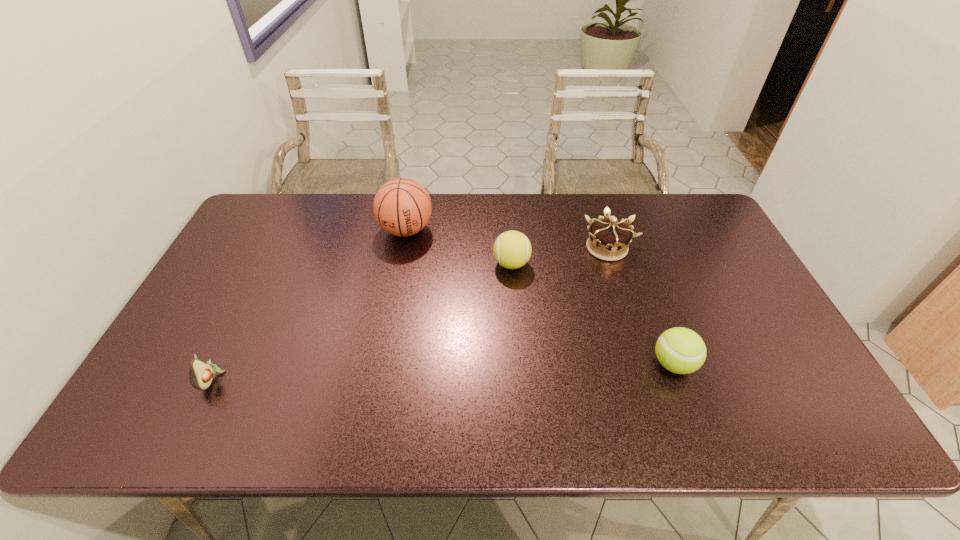
Image resolution: width=960 pixels, height=540 pixels. Identify the location of vacant space located 0.260m on the left of the right tennis ball. (544, 364).

The image size is (960, 540). Identify the location of free space located 0.340m on the seed side of the avocado. tap(365, 379).

I want to click on basketball at the far edge, so click(402, 207).

Where is `crown present at the far edge`? This screenshot has width=960, height=540. crown present at the far edge is located at coordinates (612, 237).

This screenshot has width=960, height=540. What are the coordinates of `object located in the left edge section of the desktop` in the screenshot? It's located at (201, 374).

Find the location of a particular element. Image resolution: width=960 pixels, height=540 pixels. vacant space at the far edge of the desktop is located at coordinates point(491,221).

Image resolution: width=960 pixels, height=540 pixels. I want to click on vacant space at the near edge of the desktop, so click(x=396, y=416).

You are a GUI agent. You are given a task and a screenshot of the screen. Output one action in this format:
    pyautogui.click(x=<x>, y=<y>)
    Task: Click on the vacant area at the left edge
    Image resolution: width=960 pixels, height=540 pixels.
    Given the screenshot: What is the action you would take?
    pyautogui.click(x=207, y=314)

In the image, there is a desktop. At what (x,y) coordinates should I click in order to perform the action: click on vacant space at the right edge. Please return your answer as a coordinate pair (x, y). The width and height of the screenshot is (960, 540). Looking at the image, I should click on (717, 309).

This screenshot has height=540, width=960. I want to click on vacant space at the far left corner of the desktop, so click(257, 218).